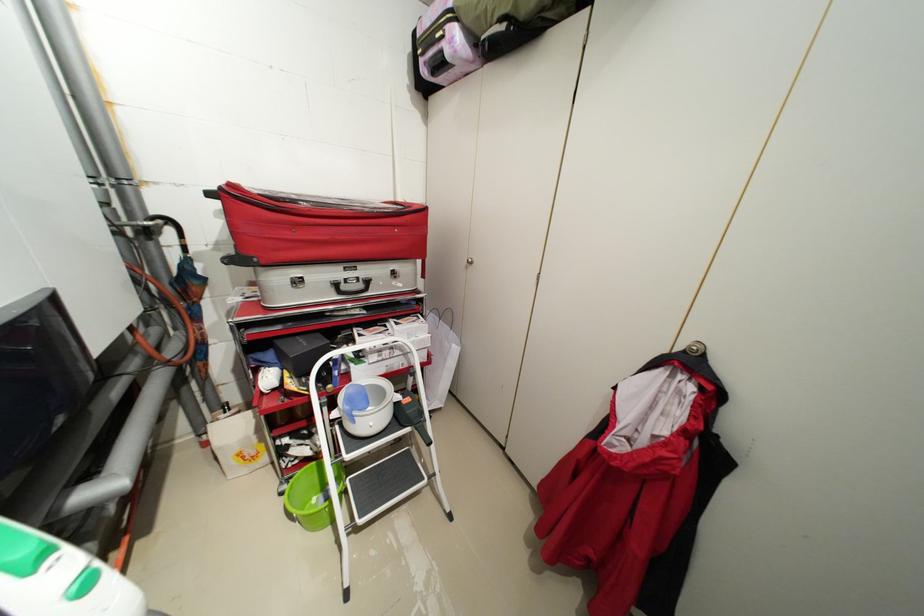
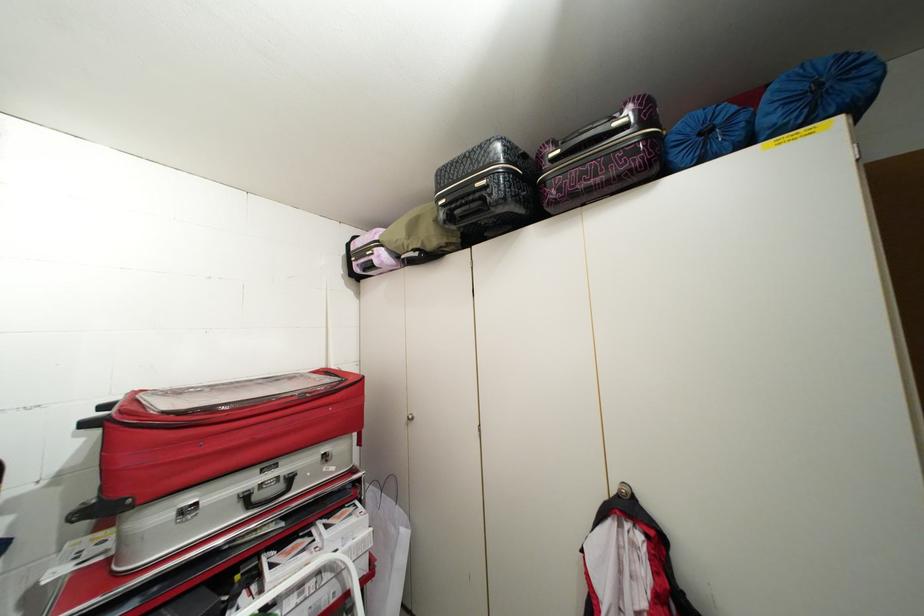
In the second image, find the point that corresponds to (x=691, y=353) in the first image.

(626, 496)